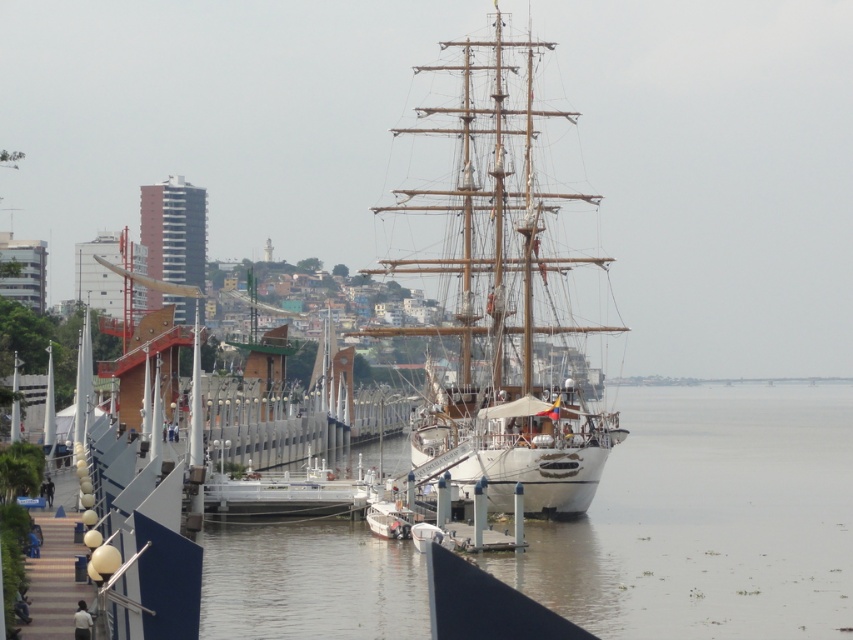
Does brown murky water at center come in front of wooden ship at center?

That is True.

Which is in front, point (657, 609) or point (492, 408)?

Positioned in front is point (657, 609).

What do you see at coordinates (708, 518) in the screenshot?
I see `brown murky water at center` at bounding box center [708, 518].

At what (x,y) coordinates should I click in order to perform the action: click on brown murky water at center. Please return your answer as a coordinate pair (x, y). This screenshot has height=640, width=853. Looking at the image, I should click on (708, 518).